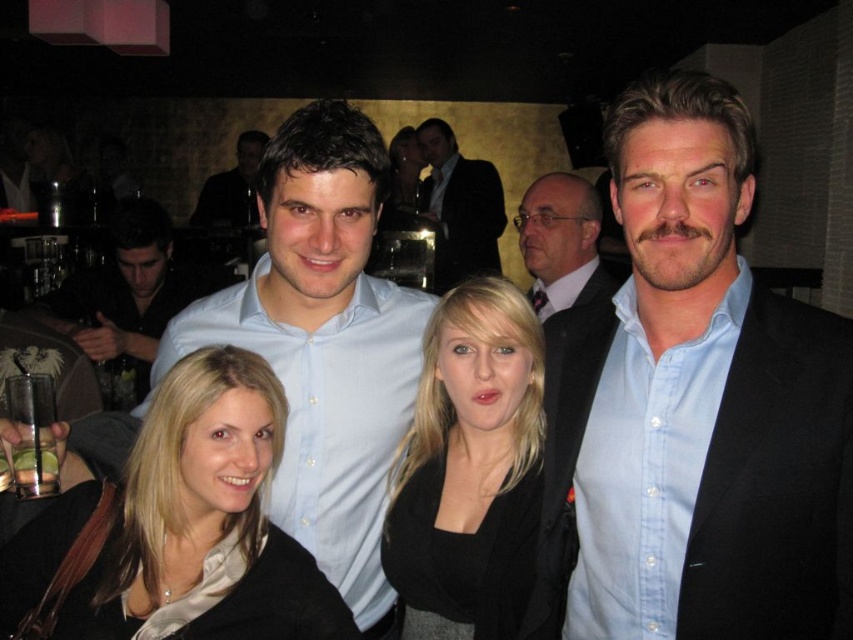
You are standing at the back of the room and want to greet the person in the blue shirt at center. Which direction should you move to approach them first, considering their position relative to the matte black suit at upper center?

The blue shirt at center is closer to the viewer than the matte black suit at upper center, so you should move forward towards the blue shirt at center directly since it is nearer to your current position at the back.

You are a photographer trying to adjust the lighting for a group photo. You notice the blue shirt at center and the matte black suit at upper center. Which of these two items requires more light to ensure proper exposure?

The blue shirt at center requires more light because it has a smaller size compared to the matte black suit at upper center, meaning it might not reflect as much light on its own.